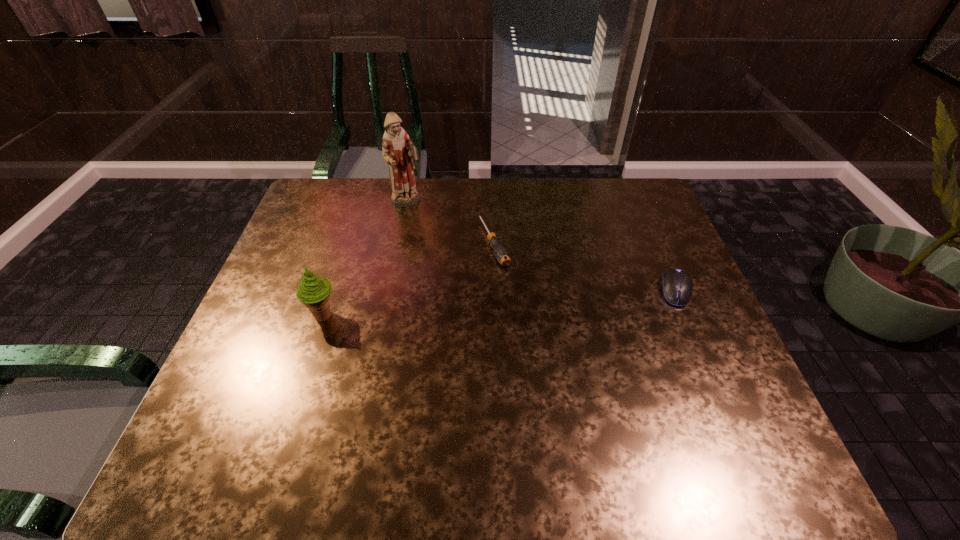
Locate an element on the screen. the leftmost object is located at coordinates (313, 291).

At what (x,y) coordinates should I click in order to perform the action: click on icecream. Please return your answer as a coordinate pair (x, y). This screenshot has width=960, height=540. Looking at the image, I should click on (313, 291).

This screenshot has height=540, width=960. Identify the location of computer mouse. (677, 286).

Locate an element on the screen. Image resolution: width=960 pixels, height=540 pixels. the tallest object is located at coordinates (398, 151).

This screenshot has height=540, width=960. I want to click on the third object from right to left, so click(398, 151).

This screenshot has width=960, height=540. What are the coordinates of `the second object from right to left` in the screenshot? It's located at (500, 252).

Locate an element on the screen. the second farthest object is located at coordinates (500, 252).

The height and width of the screenshot is (540, 960). What are the coordinates of `vacant space situated 0.090m on the left of the second tallest object` in the screenshot? It's located at (272, 316).

Where is `vacant position located 0.200m on the front of the computer mouse`? This screenshot has height=540, width=960. vacant position located 0.200m on the front of the computer mouse is located at coordinates (712, 376).

Find the location of a particular element. This screenshot has height=540, width=960. vacant space situated on the front-facing side of the farthest object is located at coordinates (456, 256).